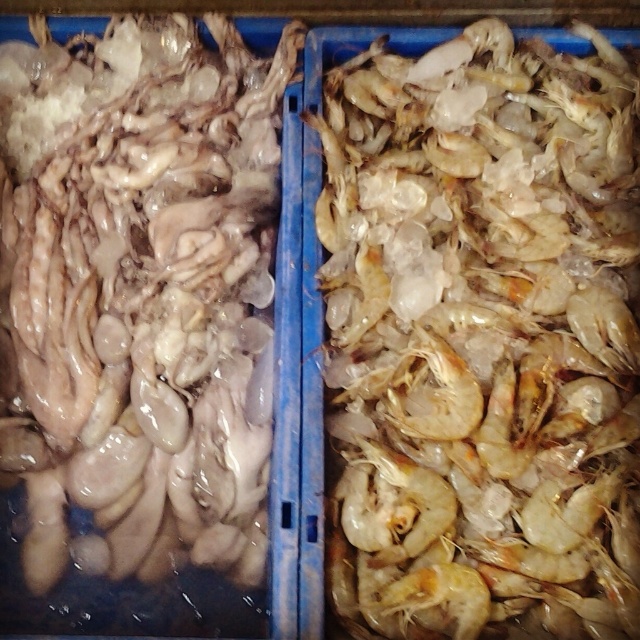
You are a seafood vendor who needs to determine which item is larger between the translucent white shrimp at right and the translucent rubber squid at left. Based on the scene, which one should you choose?

The translucent white shrimp at right is bigger than the translucent rubber squid at left, so you should choose the translucent white shrimp at right.

You are a seafood vendor who needs to pack items into boxes. The box you have can only fit items that are wider than 10 cm. You have the translucent white shrimp at right and the translucent rubber squid at left. Which of these items can fit into the box?

The translucent white shrimp at right has a larger width than the translucent rubber squid at left. Since the shrimp is wider, it is more likely to exceed the 10 cm requirement and fit into the box, provided its width meets or exceeds the minimum width specified.